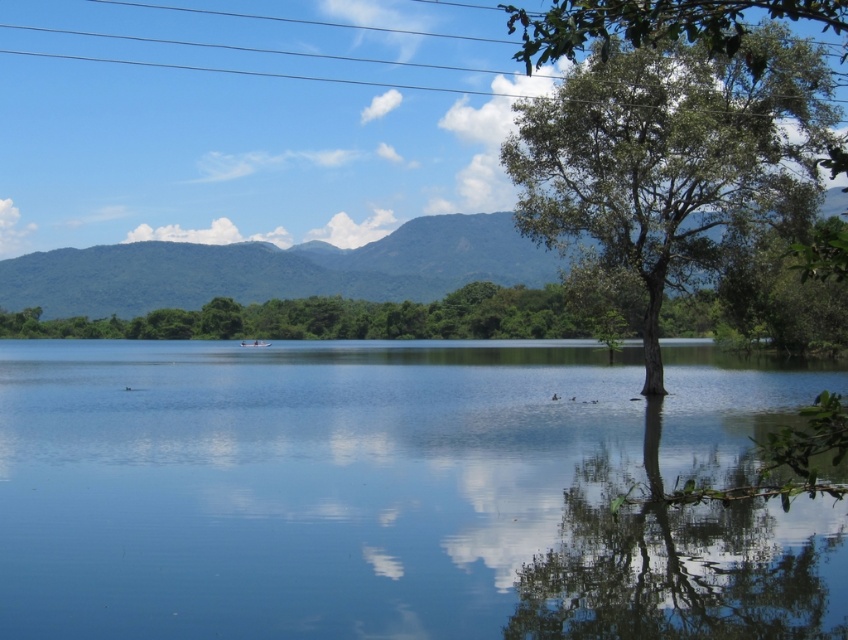
Looking at this image, you are standing on the bank of the lake and want to cross to the other side. The transparent water at center and the green leafy tree at right are in your path. Which one do you need to avoid stepping on?

The green leafy tree at right is larger than the transparent water at center, so you should avoid stepping on the green leafy tree at right as it is bigger and in your way.

You are a drone operator trying to capture the reflection of the tree in the transparent water at center. According to the coordinates provided, where should you position the drone to best capture the reflection?

The transparent water at center is located at point (399, 492), so positioning the drone above this coordinate will allow it to capture the reflection of the tree in the transparent water at center.